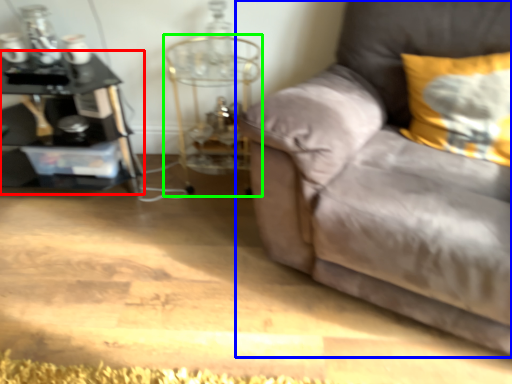
Question: Based on their relative distances, which object is farther from table (highlighted by a red box)? Choose from studio couch (highlighted by a blue box) and side table (highlighted by a green box).

Choices:
 (A) studio couch
 (B) side table

Answer: (A)